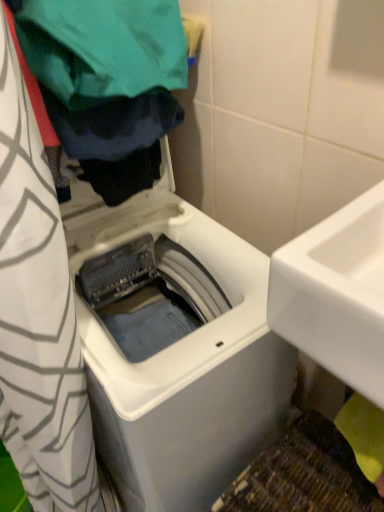
The height and width of the screenshot is (512, 384). Describe the element at coordinates (336, 294) in the screenshot. I see `white glossy sink at right` at that location.

This screenshot has height=512, width=384. In order to click on white plastic washing machine at center in this screenshot , I will do `click(174, 345)`.

What do you see at coordinates (106, 83) in the screenshot?
I see `green fabric at upper left` at bounding box center [106, 83].

This screenshot has height=512, width=384. Find the location of `white glossy sink at right`. white glossy sink at right is located at coordinates (336, 294).

Is white glossy sink at right looking in the opposite direction of white plastic washing machine at center?

white glossy sink at right does not have its back to white plastic washing machine at center.

Measure the distance from white glossy sink at right to white plastic washing machine at center.

white glossy sink at right is 26.90 centimeters from white plastic washing machine at center.

From the picture: Which of these two, white glossy sink at right or white plastic washing machine at center, is thinner?

With smaller width is white glossy sink at right.

Considering the sizes of objects green fabric at upper left and white plastic washing machine at center in the image provided, who is thinner, green fabric at upper left or white plastic washing machine at center?

green fabric at upper left is thinner.

Are green fabric at upper left and white plastic washing machine at center making contact?

No, green fabric at upper left is not next to white plastic washing machine at center.

Considering the relative sizes of green fabric at upper left and white plastic washing machine at center in the image provided, is green fabric at upper left bigger than white plastic washing machine at center?

No.

Is white glossy sink at right aimed at green fabric at upper left?

No, white glossy sink at right is not oriented towards green fabric at upper left.

Does white glossy sink at right have a smaller size compared to green fabric at upper left?

Yes.

Would you say white glossy sink at right is to the left or to the right of green fabric at upper left in the picture?

white glossy sink at right is to the right of green fabric at upper left.

Consider the image. From the image's perspective, between white plastic washing machine at center and green fabric at upper left, who is located below?

white plastic washing machine at center.

Does white plastic washing machine at center turn towards green fabric at upper left?

No.

Which object is closer to the camera, white plastic washing machine at center or green fabric at upper left?

green fabric at upper left is in front.

Does white plastic washing machine at center have a lesser width compared to green fabric at upper left?

No.

Considering the relative sizes of green fabric at upper left and white glossy sink at right in the image provided, is green fabric at upper left shorter than white glossy sink at right?

Indeed, green fabric at upper left has a lesser height compared to white glossy sink at right.

Is green fabric at upper left inside the boundaries of white glossy sink at right, or outside?

green fabric at upper left is spatially situated outside white glossy sink at right.

Which is more to the left, green fabric at upper left or white glossy sink at right?

green fabric at upper left is more to the left.

How far apart are green fabric at upper left and white glossy sink at right?

green fabric at upper left is 14.95 inches away from white glossy sink at right.

Can you see white plastic washing machine at center touching white glossy sink at right?

They are not placed beside each other.

Considering the sizes of objects white plastic washing machine at center and white glossy sink at right in the image provided, who is taller, white plastic washing machine at center or white glossy sink at right?

white plastic washing machine at center.

Considering the positions of objects white plastic washing machine at center and white glossy sink at right in the image provided, who is in front, white plastic washing machine at center or white glossy sink at right?

white glossy sink at right is in front.

Is white plastic washing machine at center bigger or smaller than white glossy sink at right?

Considering their sizes, white plastic washing machine at center takes up more space than white glossy sink at right.

Image resolution: width=384 pixels, height=512 pixels. What are the coordinates of `washing machine to the left of white glossy sink at right` in the screenshot? It's located at (174, 345).

You are a GUI agent. You are given a task and a screenshot of the screen. Output one action in this format:
    pyautogui.click(x=<x>, y=<y>)
    Task: Click on the washing machine on the right of the green fabric at upper left
    The width and height of the screenshot is (384, 512).
    Given the screenshot: What is the action you would take?
    pyautogui.click(x=174, y=345)

Looking at the image, which one is located closer to green fabric at upper left, white glossy sink at right or white plastic washing machine at center?

white plastic washing machine at center is positioned closer to the anchor green fabric at upper left.

From the image, which object appears to be farther from white plastic washing machine at center, green fabric at upper left or white glossy sink at right?

green fabric at upper left is positioned further to the anchor white plastic washing machine at center.

Looking at the image, which one is located further to white glossy sink at right, white plastic washing machine at center or green fabric at upper left?

Among the two, green fabric at upper left is located further to white glossy sink at right.

Based on their spatial positions, is green fabric at upper left or white plastic washing machine at center closer to white glossy sink at right?

white plastic washing machine at center is closer to white glossy sink at right.

Estimate the real-world distances between objects in this image. Which object is further from white plastic washing machine at center, white glossy sink at right or green fabric at upper left?

Based on the image, green fabric at upper left appears to be further to white plastic washing machine at center.

Which object lies nearer to the anchor point green fabric at upper left, white plastic washing machine at center or white glossy sink at right?

Based on the image, white plastic washing machine at center appears to be nearer to green fabric at upper left.

This screenshot has height=512, width=384. In order to click on sink between green fabric at upper left and white plastic washing machine at center from top to bottom in this screenshot , I will do `click(336, 294)`.